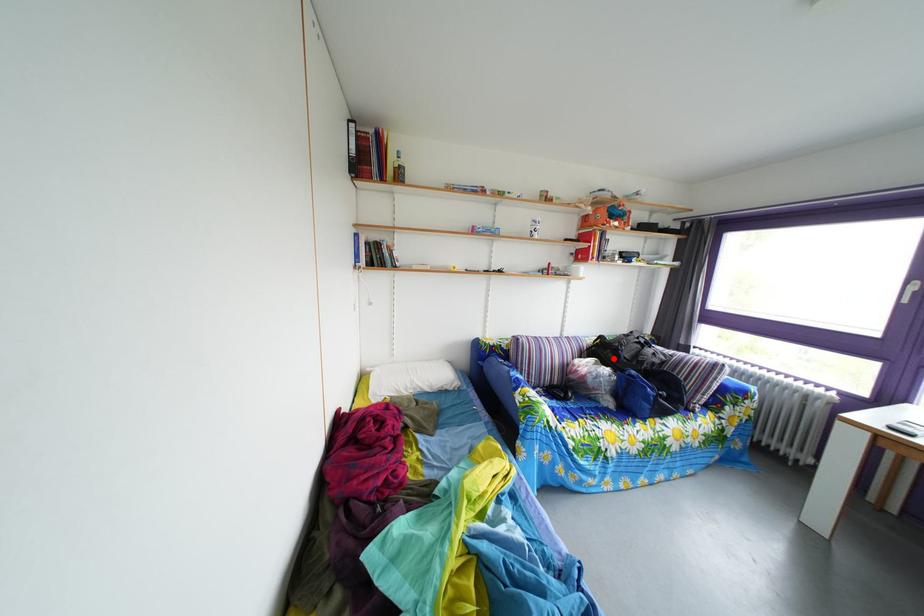
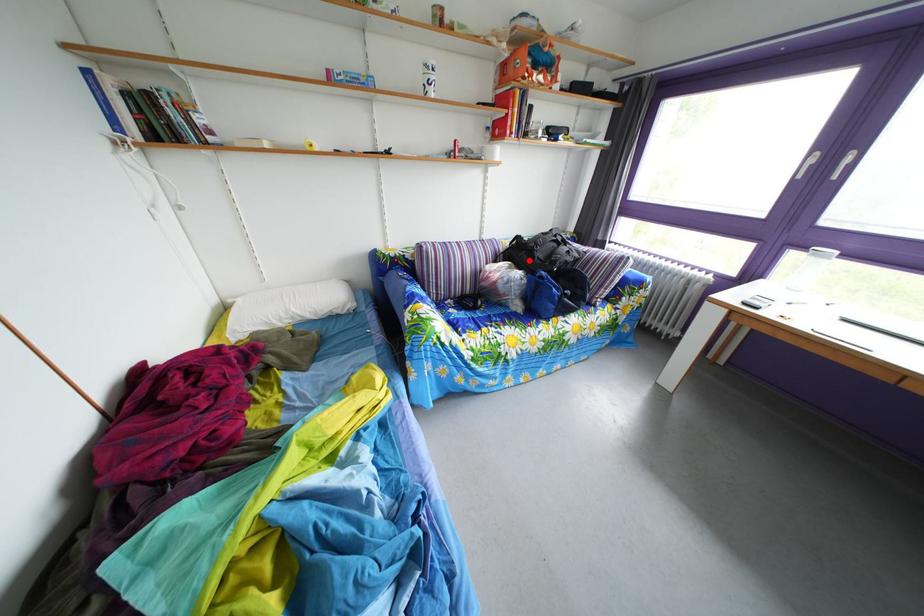
Looking at this image, I am providing you with two images of the same scene from different viewpoints. A red point is marked on the first image and another point is marked on the second image. Is the red point in image1 aligned with the point shown in image2?

Yes